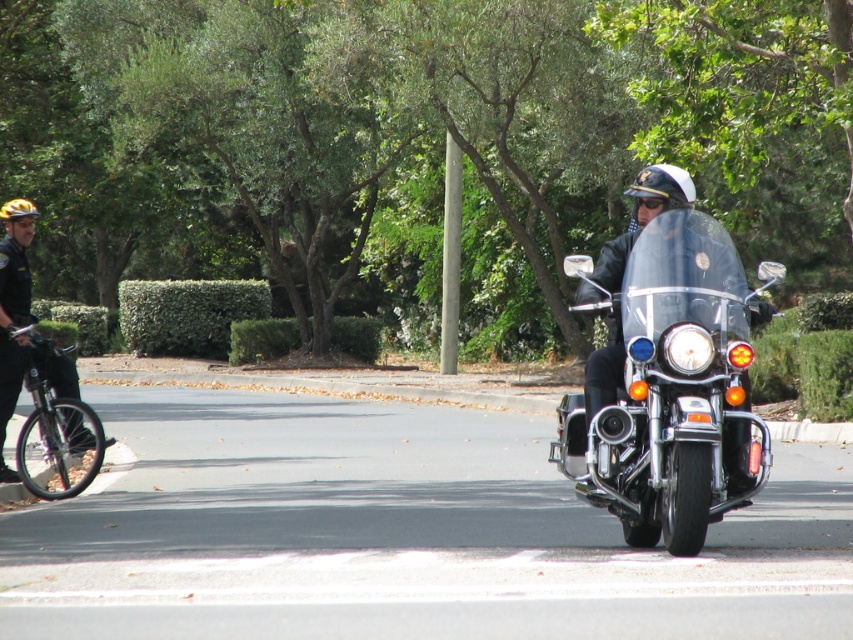
Does point (730, 461) come closer to viewer compared to point (42, 403)?

Yes, point (730, 461) is in front of point (42, 403).

Which is behind, point (674, 417) or point (62, 493)?

The point (62, 493) is more distant.

Locate an element on the screen. The height and width of the screenshot is (640, 853). black glossy motorcycle at center is located at coordinates (671, 392).